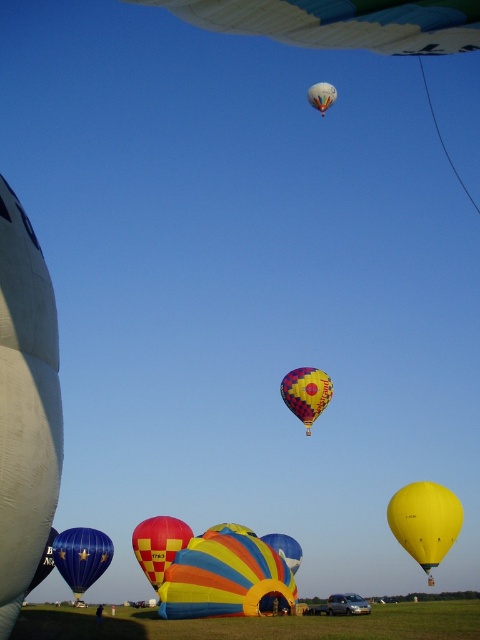
You are standing in the hot air balloon festival and want to choose a balloon to ride that is bigger. Which balloon should you choose between the yellow matte balloon at lower right and the checkered fabric balloon at lower center?

The yellow matte balloon at lower right has a larger size compared to checkered fabric balloon at lower center, so you should choose the yellow matte balloon at lower right.

You are a festival attendee standing at the center of the festival grounds. You see the yellow matte balloon at lower right and the checkered fabric balloon at lower center. Which balloon is taller?

The yellow matte balloon at lower right is taller than the checkered fabric balloon at lower center.

You are a festival attendee standing at the center of the field. You want to walk to the yellow matte balloon at lower right and then to the checkered fabric balloon at lower center. Given that you can walk 3 meters per second, how many seconds will it take you to reach both balloons one after the other?

The yellow matte balloon at lower right and checkered fabric balloon at lower center are 27.70 meters apart. To walk to both one after the other, you would need to cover the 27.70 meters distance. At a speed of 3 meters per second, it would take approximately 9.23 seconds.